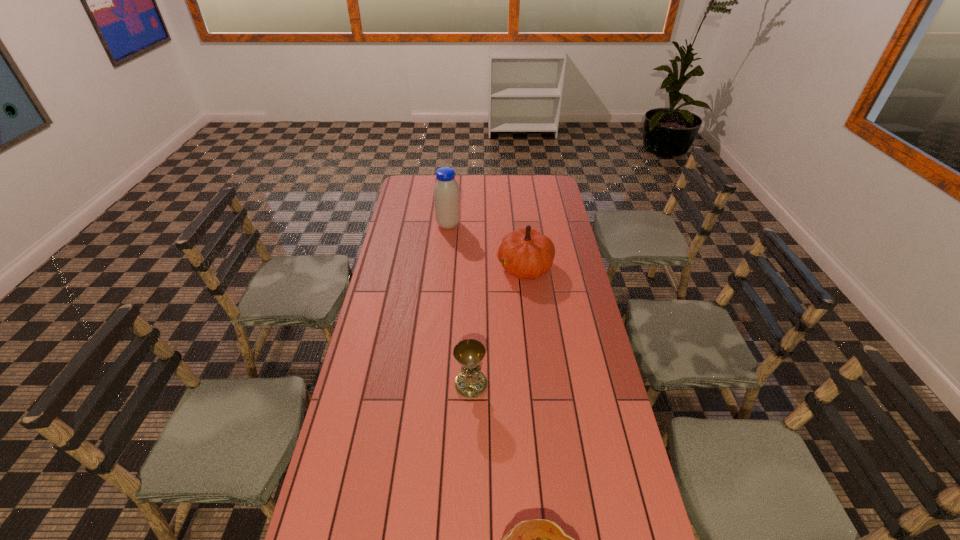
Find the location of a particular element. This screenshot has height=540, width=960. empty space that is in between the tallest object and the pumpkin is located at coordinates (487, 246).

This screenshot has height=540, width=960. In order to click on object that is the nearest to the second farthest object in this screenshot , I will do `click(446, 190)`.

Identify which object is the third closest to the pancake. Please provide its 2D coordinates. Your answer should be formatted as a tuple, i.e. [(x, y)], where the tuple contains the x and y coordinates of a point satisfying the conditions above.

[(446, 190)]

At what (x,y) coordinates should I click in order to perform the action: click on free space that satisfies the following two spatial constraints: 1. on the front-facing side of the second farthest object; 2. on the front side of the third object from right to left. Please return your answer as a coordinate pair (x, y). This screenshot has width=960, height=540. Looking at the image, I should click on (540, 384).

Identify the location of free space that satisfies the following two spatial constraints: 1. on the front side of the soya milk; 2. on the left side of the second shortest object. (433, 384).